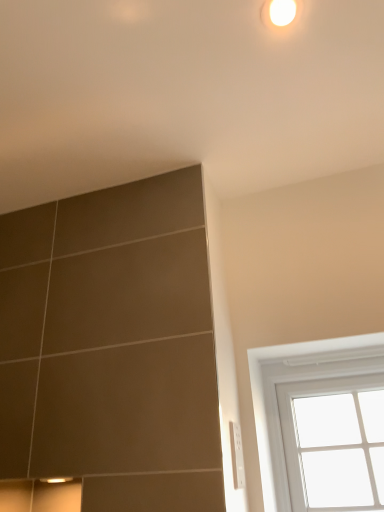
Question: Is white plastic electrical outlet at lower right wider or thinner than white glossy light at upper center?

Choices:
 (A) thin
 (B) wide

Answer: (A)

Question: Relative to white glossy light at upper center, is white plastic electrical outlet at lower right in front or behind?

Choices:
 (A) front
 (B) behind

Answer: (B)

Question: Considering the real-world distances, which object is farthest from the white glossy light at upper center?

Choices:
 (A) white plastic electrical outlet at lower right
 (B) white glass window at upper right

Answer: (B)

Question: Which object is positioned farthest from the white plastic electrical outlet at lower right?

Choices:
 (A) white glass window at upper right
 (B) white glossy light at upper center

Answer: (B)